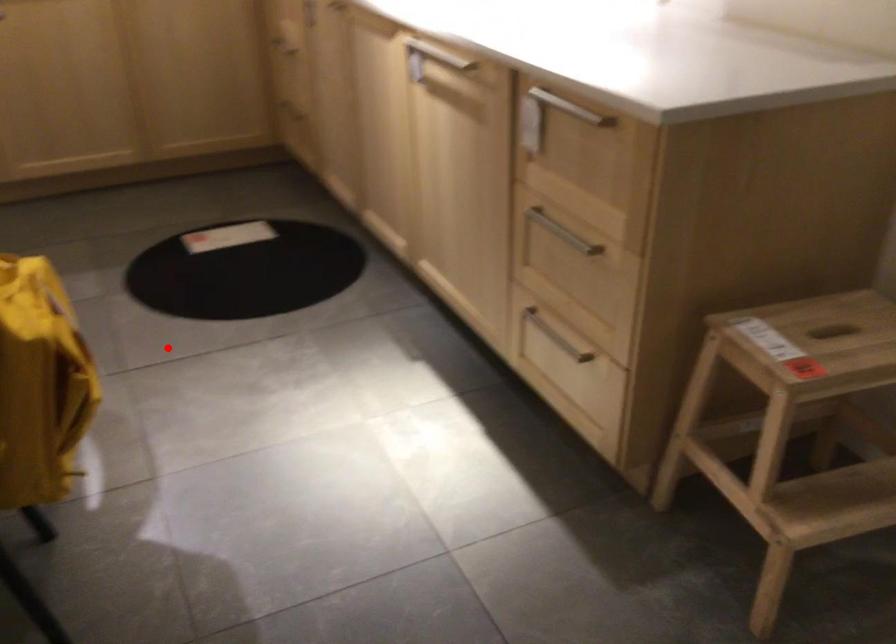
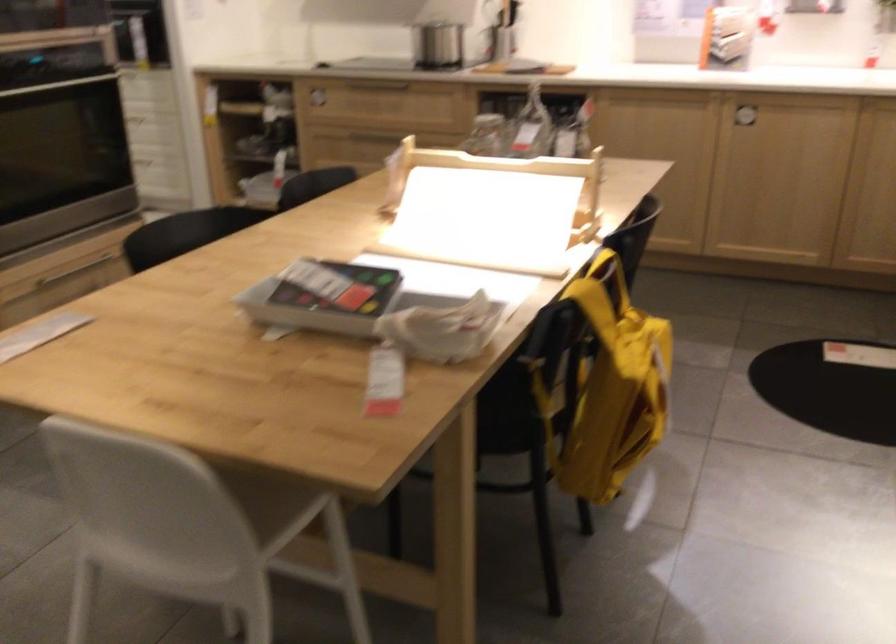
Where in the second image is the point corresponding to the highlighted location from the first image?

(760, 419)